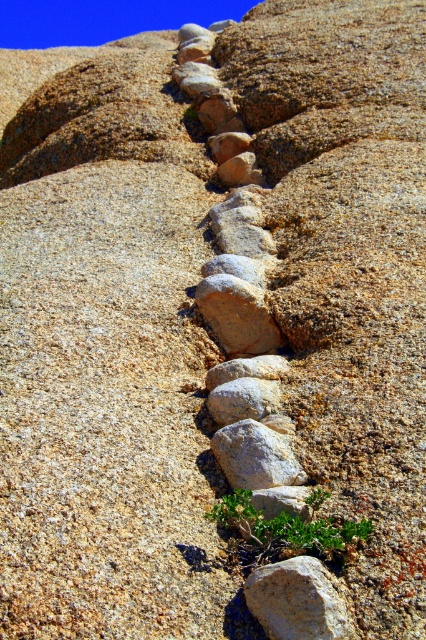
Question: Which object is positioned closest to the green leafy plant at lower center?

Choices:
 (A) gray/granite rock at center
 (B) gray rough rock at center

Answer: (B)

Question: Is gray/granite rock at center closer to the viewer compared to smooth gray rock at center?

Choices:
 (A) no
 (B) yes

Answer: (B)

Question: Is green leafy plant at lower center to the right of smooth gray rock at center from the viewer's perspective?

Choices:
 (A) yes
 (B) no

Answer: (A)

Question: Considering the real-world distances, which object is closest to the gray rough rock at center?

Choices:
 (A) gray/granite rock at center
 (B) green leafy plant at lower center
 (C) smooth gray rock at center

Answer: (B)

Question: Is green leafy plant at lower center below gray/granite rock at center?

Choices:
 (A) no
 (B) yes

Answer: (B)

Question: Which is farther from the smooth gray rock at center?

Choices:
 (A) green leafy plant at lower center
 (B) gray/granite rock at center
 (C) gray rough rock at center

Answer: (C)